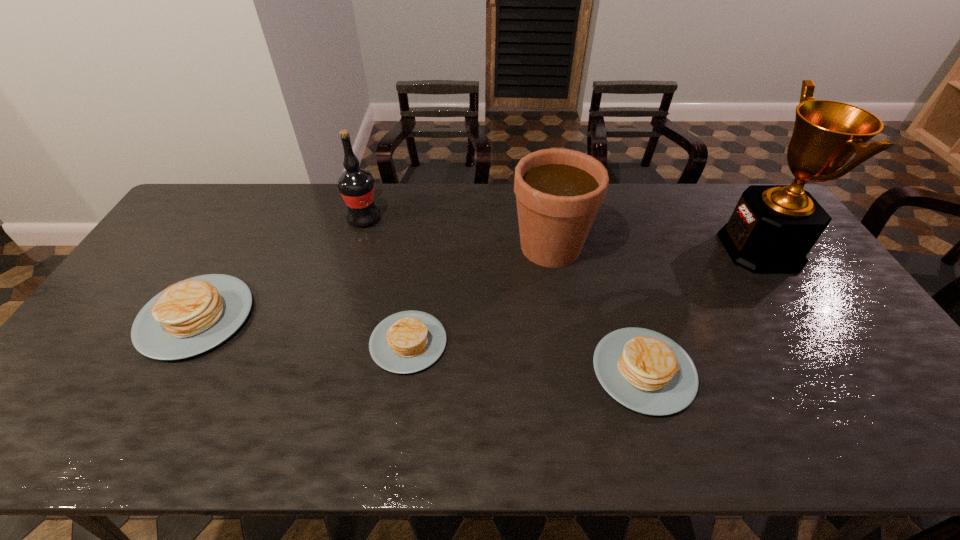
Point out which object is positioned as the third nearest to the leftmost pancake. Please provide its 2D coordinates. Your answer should be formatted as a tuple, i.e. [(x, y)], where the tuple contains the x and y coordinates of a point satisfying the conditions above.

[(558, 192)]

Locate an element on the screen. The image size is (960, 540). pancake that can be found as the second closest to the trophy cup is located at coordinates (406, 342).

This screenshot has height=540, width=960. Find the location of `the second closest pancake to the second object from left to right`. the second closest pancake to the second object from left to right is located at coordinates (406, 342).

Where is `blank area in the image that satisfies the following two spatial constraints: 1. on the front side of the second shortest pancake; 2. on the left side of the flowerpot`? This screenshot has width=960, height=540. blank area in the image that satisfies the following two spatial constraints: 1. on the front side of the second shortest pancake; 2. on the left side of the flowerpot is located at coordinates (571, 371).

Locate an element on the screen. Image resolution: width=960 pixels, height=540 pixels. free spot that satisfies the following two spatial constraints: 1. on the front side of the leftmost object; 2. on the right side of the fourth object from right to left is located at coordinates (181, 342).

Locate an element on the screen. free spot that satisfies the following two spatial constraints: 1. on the front side of the leftmost pancake; 2. on the right side of the second pancake from left to right is located at coordinates (181, 342).